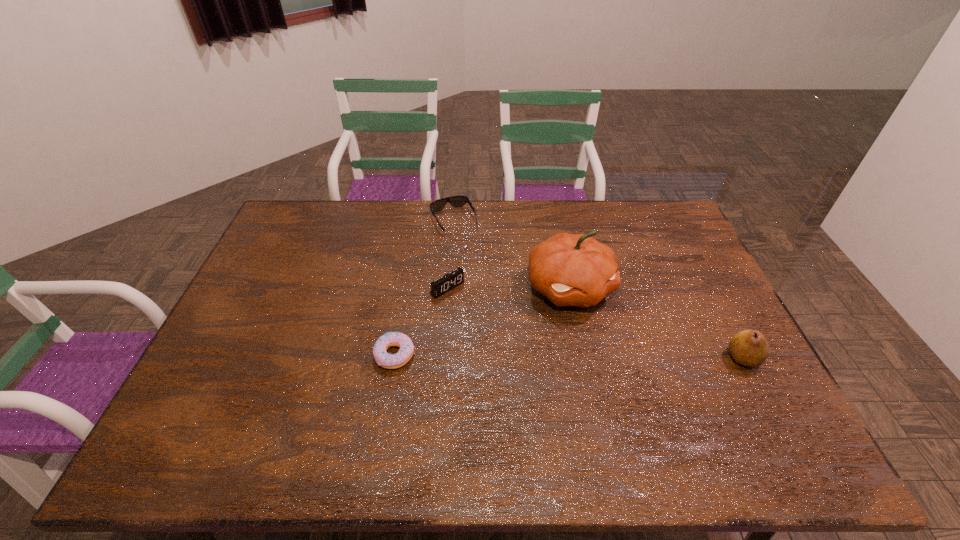
Locate an element on the screen. Image resolution: width=960 pixels, height=540 pixels. doughnut is located at coordinates (382, 358).

What are the coordinates of `the second tallest object` in the screenshot? It's located at (749, 348).

Locate an element on the screen. This screenshot has width=960, height=540. the rightmost object is located at coordinates (749, 348).

Find the location of a particular element. sunglasses is located at coordinates (456, 201).

You are a GUI agent. You are given a task and a screenshot of the screen. Output one action in this format:
    pyautogui.click(x=<x>, y=<y>)
    Task: Click on the alarm clock
    This screenshot has height=540, width=960.
    Given the screenshot: What is the action you would take?
    pyautogui.click(x=440, y=286)

Image resolution: width=960 pixels, height=540 pixels. In order to click on pumpkin in this screenshot , I will do `click(569, 269)`.

Where is `the tallest object`? This screenshot has width=960, height=540. the tallest object is located at coordinates (569, 269).

The height and width of the screenshot is (540, 960). Find the location of `vacant space situated on the right of the doughnut`. vacant space situated on the right of the doughnut is located at coordinates (522, 355).

This screenshot has height=540, width=960. I want to click on free region located on the left of the second tallest object, so click(704, 357).

Locate an element on the screen. blank area located 0.290m on the front-facing side of the farthest object is located at coordinates (491, 291).